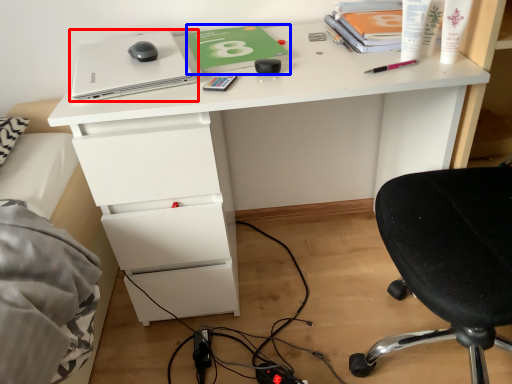
Question: Which object appears farthest to the camera in this image, laptop (highlighted by a red box) or notebook (highlighted by a blue box)?

Choices:
 (A) laptop
 (B) notebook

Answer: (B)